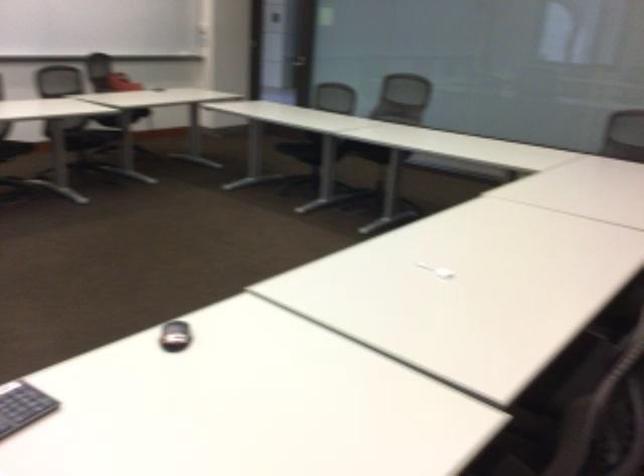
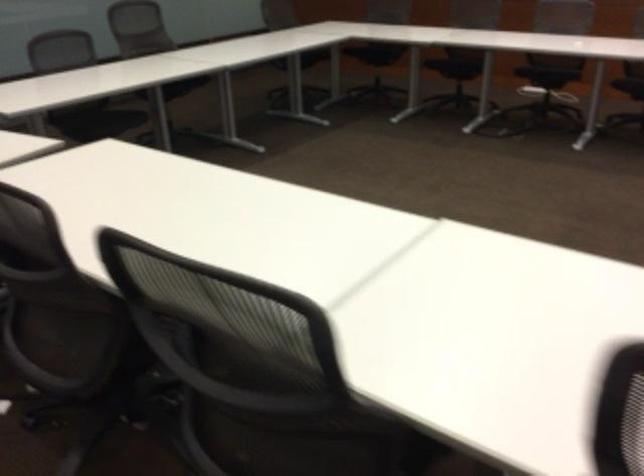
Question: In a continuous first-person perspective shot, in which direction is the camera moving?

Choices:
 (A) Left
 (B) Right
 (C) Forward
 (D) Backward

Answer: (D)